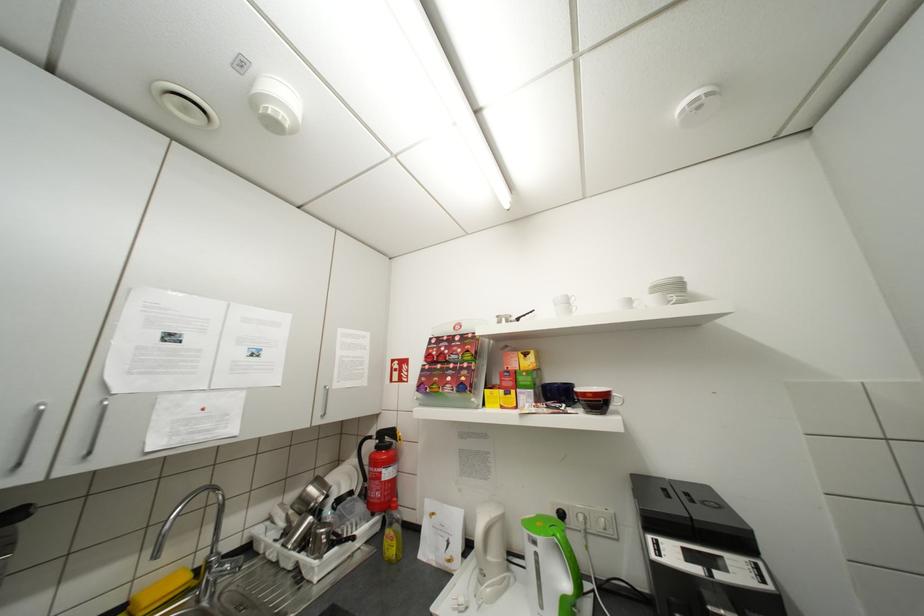
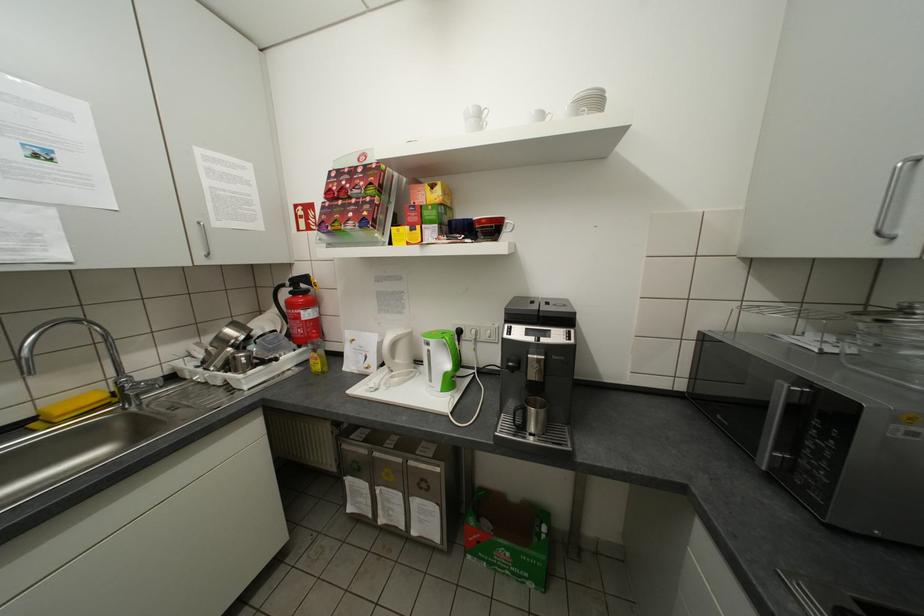
Find the pixel in the second image that matches point (601, 395) in the first image.

(494, 222)